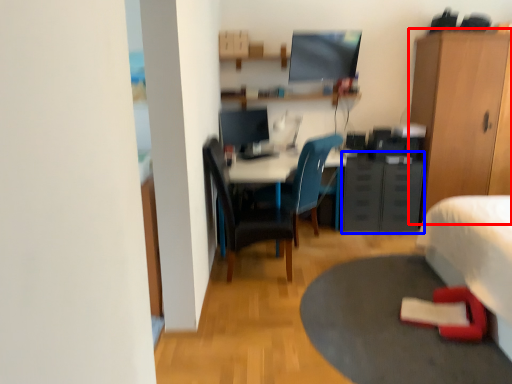
Question: Which of the following is the farthest to the observer, cabinetry (highlighted by a red box) or file cabinet (highlighted by a blue box)?

Choices:
 (A) cabinetry
 (B) file cabinet

Answer: (B)